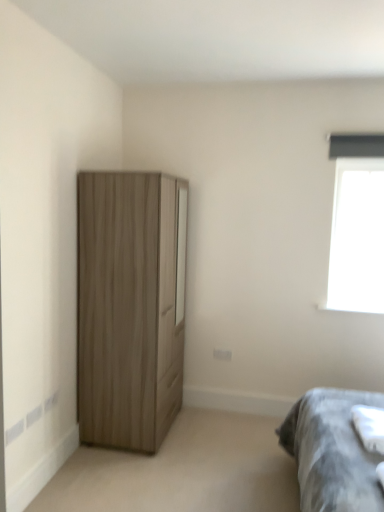
Question: Is transparent glass window at upper right to the right of wooden wardrobe at left from the viewer's perspective?

Choices:
 (A) yes
 (B) no

Answer: (A)

Question: Is transparent glass window at upper right positioned behind wooden wardrobe at left?

Choices:
 (A) no
 (B) yes

Answer: (B)

Question: Is wooden wardrobe at left at the back of transparent glass window at upper right?

Choices:
 (A) no
 (B) yes

Answer: (A)

Question: From the image's perspective, does transparent glass window at upper right appear higher than wooden wardrobe at left?

Choices:
 (A) yes
 (B) no

Answer: (A)

Question: From a real-world perspective, does transparent glass window at upper right sit lower than wooden wardrobe at left?

Choices:
 (A) yes
 (B) no

Answer: (B)

Question: Could wooden wardrobe at left be considered to be inside transparent glass window at upper right?

Choices:
 (A) yes
 (B) no

Answer: (B)

Question: Is wooden wardrobe at left aimed at transparent glass window at upper right?

Choices:
 (A) yes
 (B) no

Answer: (A)

Question: Is wooden wardrobe at left to the left of transparent glass window at upper right from the viewer's perspective?

Choices:
 (A) yes
 (B) no

Answer: (A)

Question: From the image's perspective, does wooden wardrobe at left appear lower than transparent glass window at upper right?

Choices:
 (A) no
 (B) yes

Answer: (B)

Question: Is wooden wardrobe at left facing away from transparent glass window at upper right?

Choices:
 (A) yes
 (B) no

Answer: (B)

Question: Is wooden wardrobe at left to the right of transparent glass window at upper right from the viewer's perspective?

Choices:
 (A) yes
 (B) no

Answer: (B)

Question: From the image's perspective, is wooden wardrobe at left on transparent glass window at upper right?

Choices:
 (A) yes
 (B) no

Answer: (B)

Question: Considering the relative sizes of gray fabric bedsheet at lower right and wooden wardrobe at left in the image provided, is gray fabric bedsheet at lower right wider than wooden wardrobe at left?

Choices:
 (A) no
 (B) yes

Answer: (A)